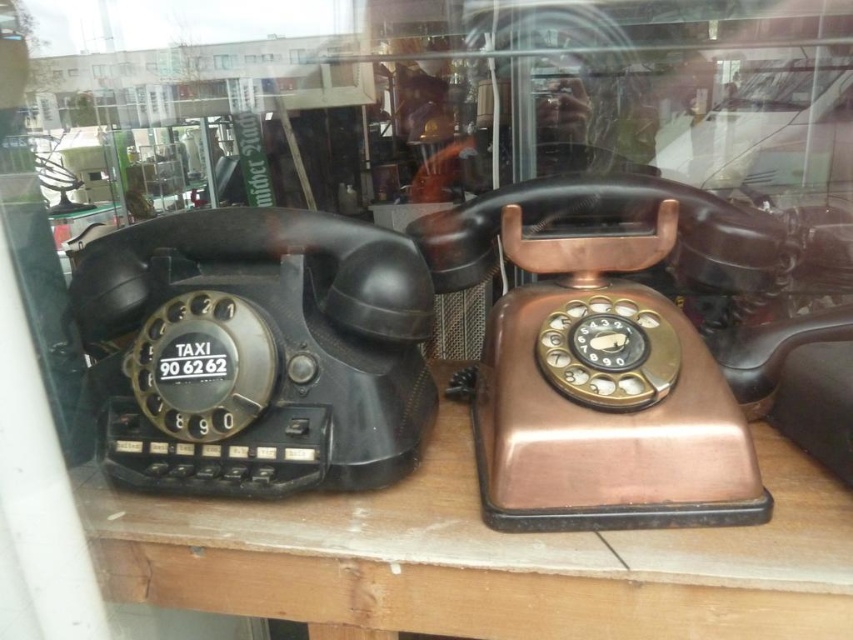
Who is lower down, brown wood table at center or matte black telephone at left?

brown wood table at center is below.

Between point (440, 496) and point (395, 296), which one is positioned in front?

Point (395, 296)

At what (x,y) coordinates should I click in order to perform the action: click on brown wood table at center. Please return your answer as a coordinate pair (x, y). This screenshot has height=640, width=853. Looking at the image, I should click on (482, 557).

Who is taller, matte black telephone at left or copper metallic telephone at center?

With more height is copper metallic telephone at center.

Is matte black telephone at left to the right of copper metallic telephone at center from the viewer's perspective?

In fact, matte black telephone at left is to the left of copper metallic telephone at center.

Is point (338, 221) in front of point (544, 365)?

That is False.

Find the location of a particular element. matte black telephone at left is located at coordinates (256, 352).

Consider the image. Who is higher up, brown wood table at center or copper metallic telephone at center?

copper metallic telephone at center is above.

Between point (267, 508) and point (697, 236), which one is positioned in front?

Point (267, 508)

Image resolution: width=853 pixels, height=640 pixels. What are the coordinates of `brown wood table at center` in the screenshot? It's located at (482, 557).